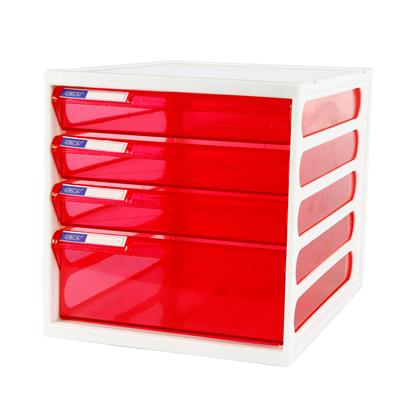
The image size is (400, 400). Identify the location of right side view of red drawers. (337, 106), (334, 155), (337, 197), (335, 234), (331, 284).